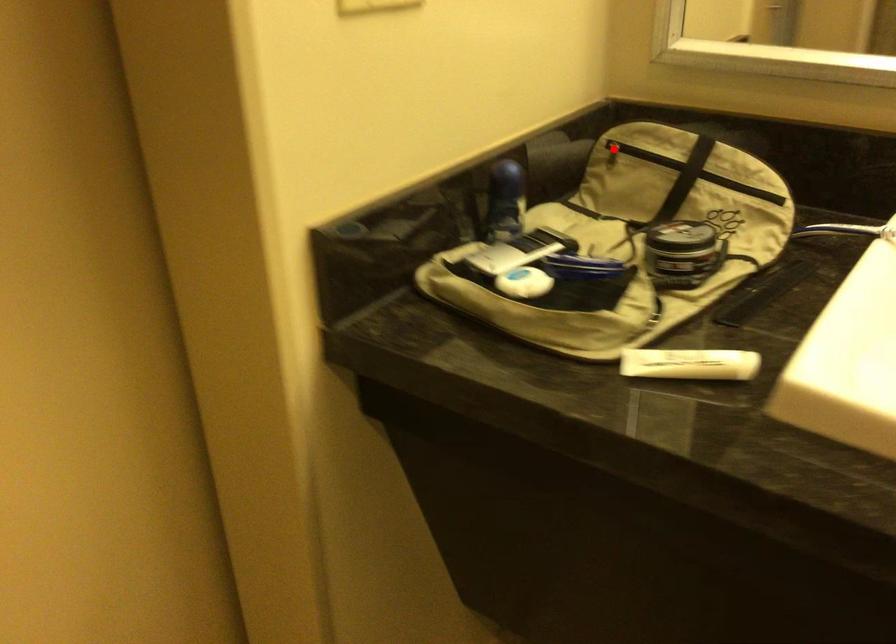
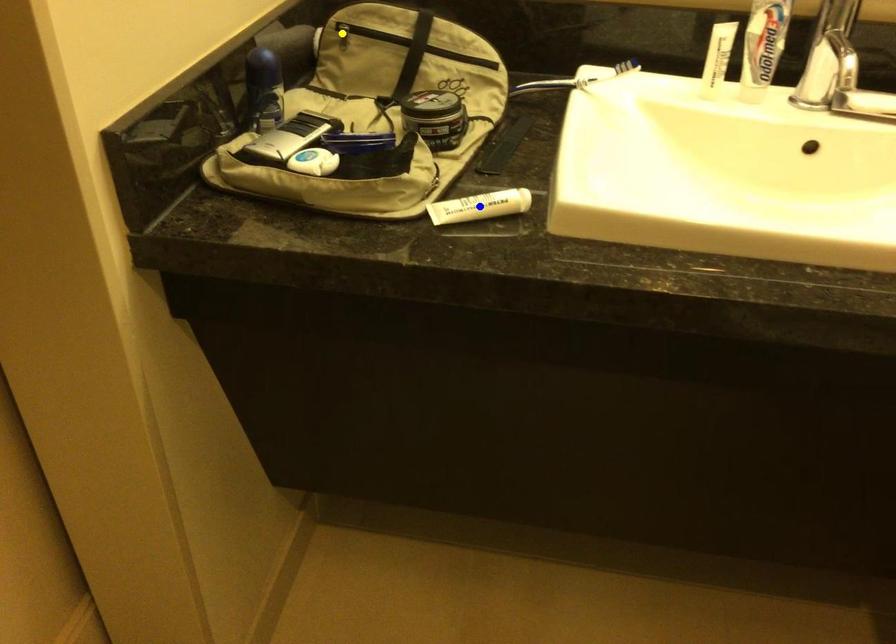
Question: I am providing you with two images of the same scene from different viewpoints. A red point is marked on the first image. You are given multiple points on the second image. Can you choose the point in image 2 that corresponds to the point in image 1?

Choices:
 (A) yellow point
 (B) green point
 (C) blue point

Answer: (A)